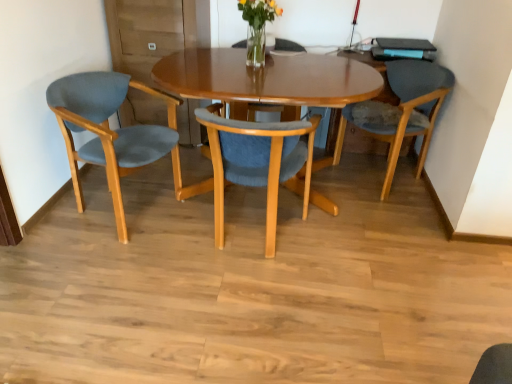
Question: Considering the relative sizes of matte wood chair at center, acting as the 2th chair starting from the left, and translucent glass vase at upper center in the image provided, is matte wood chair at center, acting as the 2th chair starting from the left, shorter than translucent glass vase at upper center?

Choices:
 (A) yes
 (B) no

Answer: (B)

Question: Is matte wood chair at center, acting as the 2th chair starting from the left, aimed at translucent glass vase at upper center?

Choices:
 (A) yes
 (B) no

Answer: (B)

Question: From the image's perspective, is matte wood chair at center, positioned as the 2th chair in right-to-left order, on translucent glass vase at upper center?

Choices:
 (A) yes
 (B) no

Answer: (B)

Question: From a real-world perspective, does matte wood chair at center, acting as the 2th chair starting from the left, sit lower than translucent glass vase at upper center?

Choices:
 (A) no
 (B) yes

Answer: (B)

Question: Is translucent glass vase at upper center completely or partially inside matte wood chair at center, acting as the 2th chair starting from the left?

Choices:
 (A) no
 (B) yes

Answer: (A)

Question: Is matte wood chair at center, positioned as the 2th chair in right-to-left order, closer to the viewer compared to translucent glass vase at upper center?

Choices:
 (A) yes
 (B) no

Answer: (A)

Question: Is translucent glass vase at upper center at the left side of matte wood chair at center, acting as the 2th chair starting from the left?

Choices:
 (A) no
 (B) yes

Answer: (A)

Question: Is translucent glass vase at upper center turned away from matte wood chair at center, acting as the 2th chair starting from the left?

Choices:
 (A) no
 (B) yes

Answer: (A)

Question: Is translucent glass vase at upper center further to camera compared to matte wood chair at center, positioned as the 2th chair in right-to-left order?

Choices:
 (A) yes
 (B) no

Answer: (A)

Question: Does translucent glass vase at upper center have a greater width compared to matte wood chair at center, positioned as the 2th chair in right-to-left order?

Choices:
 (A) yes
 (B) no

Answer: (B)

Question: Would you say translucent glass vase at upper center contains matte wood chair at center, acting as the 2th chair starting from the left?

Choices:
 (A) no
 (B) yes

Answer: (A)

Question: Is translucent glass vase at upper center bigger than matte wood chair at center, acting as the 2th chair starting from the left?

Choices:
 (A) no
 (B) yes

Answer: (A)

Question: Does matte blue cushioned chair at right, placed as the third chair when sorted from left to right, appear on the right side of matte wood chair at center, acting as the 2th chair starting from the left?

Choices:
 (A) no
 (B) yes

Answer: (B)